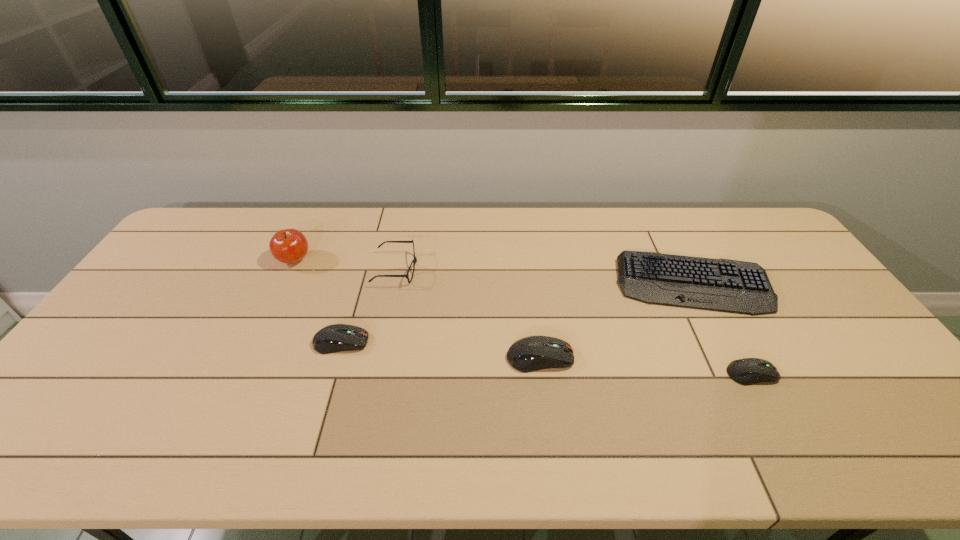
Find the location of a particular element. The image size is (960, 540). vacant space at the far right corner is located at coordinates (730, 209).

At what (x,y) coordinates should I click in order to perform the action: click on free spot between the shortest computer equipment and the spectacles. Please return your answer as a coordinate pair (x, y). The width and height of the screenshot is (960, 540). Looking at the image, I should click on (574, 322).

You are a GUI agent. You are given a task and a screenshot of the screen. Output one action in this format:
    pyautogui.click(x=<x>, y=<y>)
    Task: Click on the free space between the shortest computer equipment and the tallest object
    This screenshot has height=540, width=960.
    Given the screenshot: What is the action you would take?
    pyautogui.click(x=523, y=317)

This screenshot has width=960, height=540. I want to click on free area in between the third object from right to left and the spectacles, so click(468, 314).

At what (x,y) coordinates should I click in order to perform the action: click on vacant point located between the rightmost computer equipment and the spectacles. Please return your answer as a coordinate pair (x, y). Looking at the image, I should click on (574, 322).

Find the location of `empty space between the shortest computer equipment and the spectacles`. empty space between the shortest computer equipment and the spectacles is located at coordinates (574, 322).

Where is `free area in between the spectacles and the shortest computer equipment`? free area in between the spectacles and the shortest computer equipment is located at coordinates (574, 322).

Where is `free space between the spectacles and the rightmost computer equipment`? The image size is (960, 540). free space between the spectacles and the rightmost computer equipment is located at coordinates (574, 322).

Locate an element on the screen. The image size is (960, 540). free space between the fourth object from left to right and the leftmost computer equipment is located at coordinates (441, 350).

Identify which object is the fifth nearest to the second computer equipment from right to left. Please provide its 2D coordinates. Your answer should be formatted as a tuple, i.e. [(x, y)], where the tuple contains the x and y coordinates of a point satisfying the conditions above.

[(289, 246)]